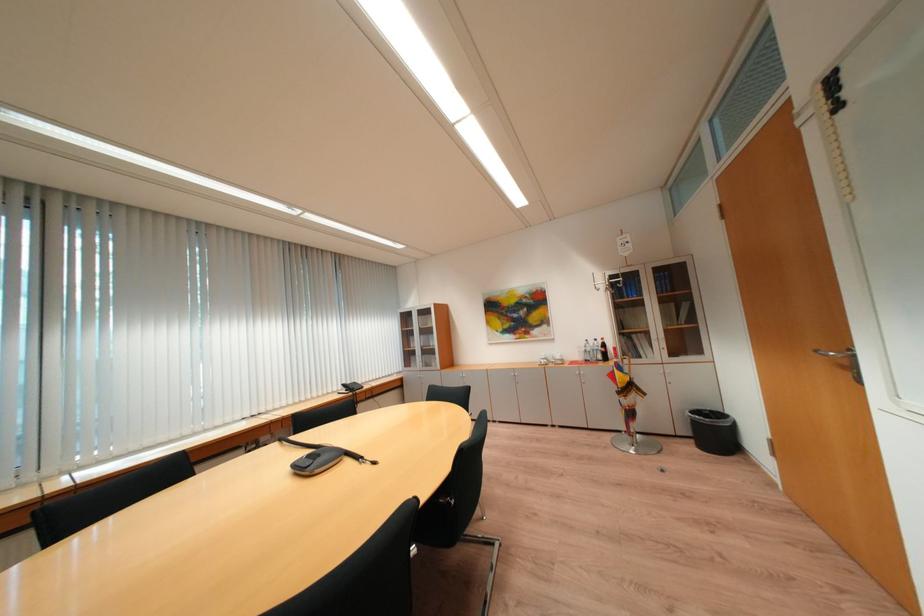
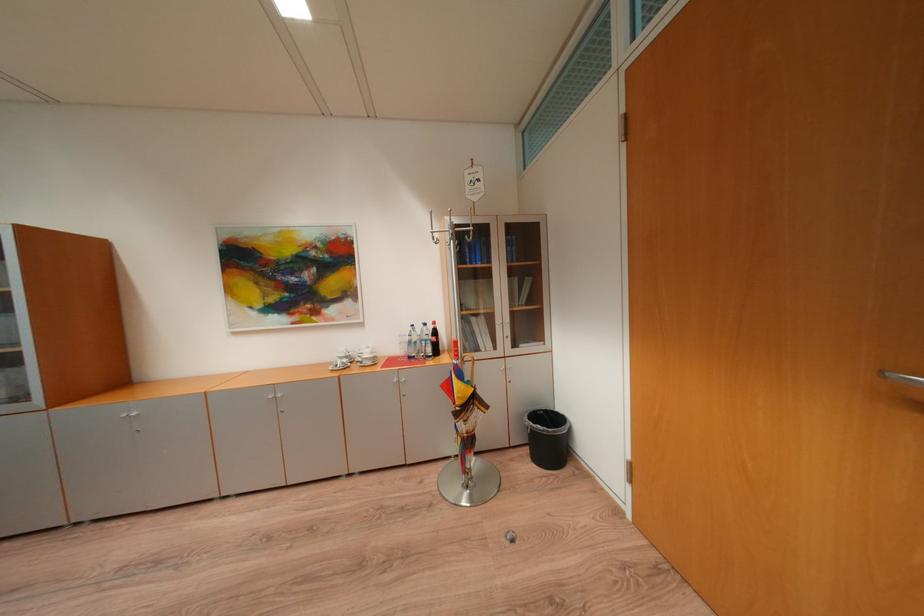
Locate, in the second image, the point that corresponds to the point at 553,360 in the first image.

(355, 359)